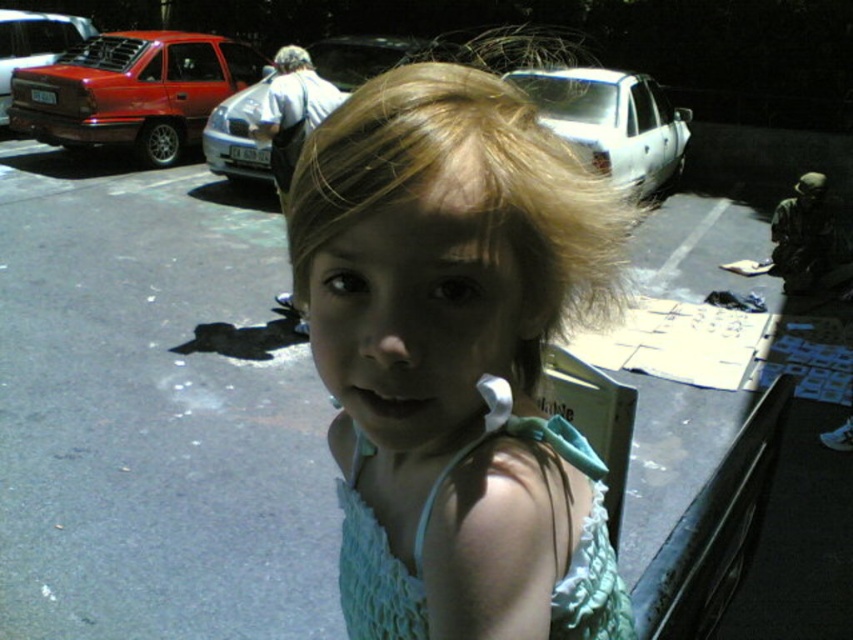
Which is in front, point (567, 592) or point (328, 44)?

Positioned in front is point (567, 592).

Is light blue lace dress at center smaller than shiny black car at upper center?

Yes, light blue lace dress at center is smaller than shiny black car at upper center.

Find the location of a particular element. The height and width of the screenshot is (640, 853). light blue lace dress at center is located at coordinates (577, 541).

Between point (390, 576) and point (227, 115), which one is positioned in front?

Point (390, 576)

Is light blue lace dress at center closer to camera compared to metallic silver car at center?

Yes, it is in front of metallic silver car at center.

Between point (604, 589) and point (254, 179), which one is positioned in front?

Point (604, 589)

This screenshot has height=640, width=853. I want to click on light blue lace dress at center, so click(x=577, y=541).

Can you confirm if matte red car at left is bigger than blonde hair at upper center?

No, matte red car at left is not bigger than blonde hair at upper center.

Can you confirm if matte red car at left is shorter than blonde hair at upper center?

Correct, matte red car at left is not as tall as blonde hair at upper center.

Who is more forward, (15, 67) or (294, 70)?

Point (294, 70)

Where is `matte red car at left`? The image size is (853, 640). matte red car at left is located at coordinates (33, 44).